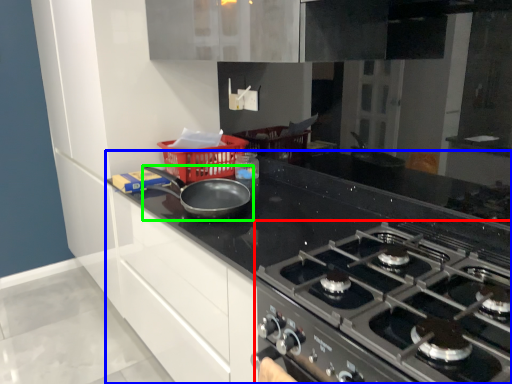
Question: Considering the real-world distances, which object is closest to gas stove (highlighted by a red box)? countertop (highlighted by a blue box) or kitchen appliance (highlighted by a green box).

Choices:
 (A) countertop
 (B) kitchen appliance

Answer: (A)